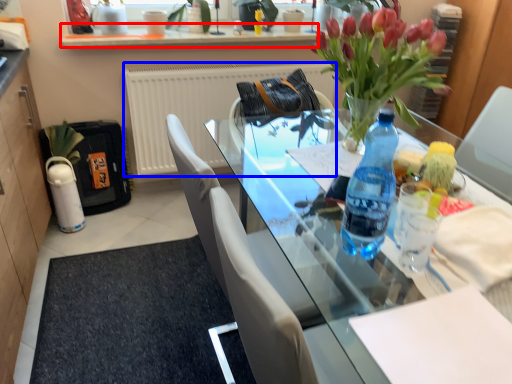
Question: Which object appears farthest to the camera in this image, window sill (highlighted by a red box) or radiator (highlighted by a blue box)?

Choices:
 (A) window sill
 (B) radiator

Answer: (B)